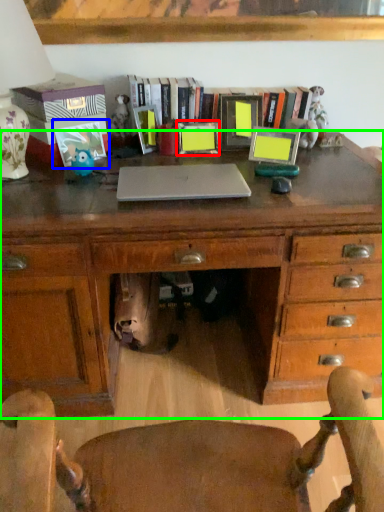
Question: Which object is positioned farthest from picture frame (highlighted by a red box)? Select from picture frame (highlighted by a blue box) and desk (highlighted by a green box).

Choices:
 (A) picture frame
 (B) desk

Answer: (B)